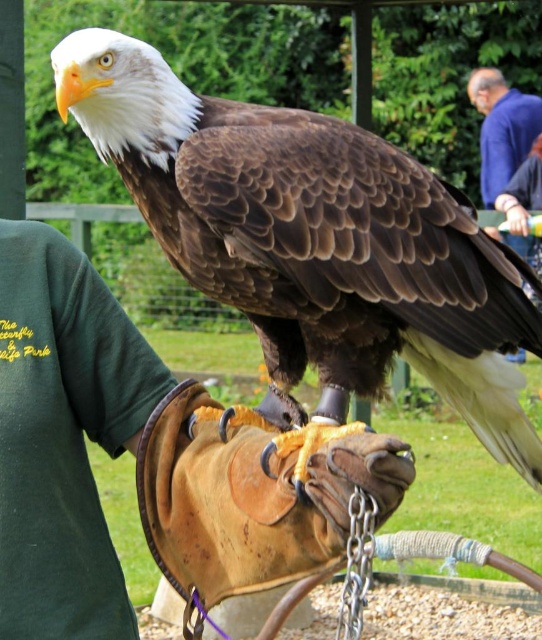
Question: Does blue fabric jacket at upper right have a smaller size compared to green fabric arm at upper right?

Choices:
 (A) yes
 (B) no

Answer: (B)

Question: Is brown feathered eagle at center smaller than blue fabric jacket at upper right?

Choices:
 (A) yes
 (B) no

Answer: (B)

Question: Which object appears farthest from the camera in this image?

Choices:
 (A) blue fabric jacket at upper right
 (B) brown leather baseball glove at center
 (C) matte black glove at upper right
 (D) green fabric arm at upper right

Answer: (A)

Question: Which of the following is the farthest from the observer?

Choices:
 (A) (215, 508)
 (B) (485, 228)
 (C) (527, 156)

Answer: (C)

Question: Estimate the real-world distances between objects in this image. Which object is farther from the brown leather baseball glove at center?

Choices:
 (A) matte black glove at upper right
 (B) green fabric arm at upper right
 (C) smooth skin hand at upper right

Answer: (B)

Question: Can you confirm if brown leather baseball glove at center is bigger than green fabric arm at upper right?

Choices:
 (A) no
 (B) yes

Answer: (A)